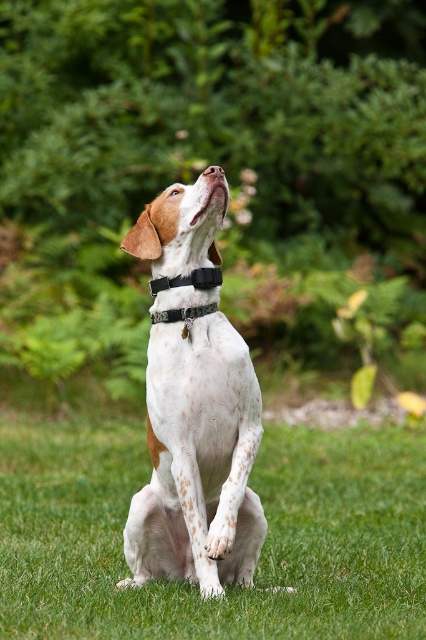
Question: Which point is closer to the camera?

Choices:
 (A) green grass at center
 (B) black fabric neckband at center

Answer: (B)

Question: Is green grass at center to the left of white speckled fur at center from the viewer's perspective?

Choices:
 (A) no
 (B) yes

Answer: (B)

Question: Which object is closer to the camera taking this photo?

Choices:
 (A) black fabric neckband at center
 (B) green grass at center

Answer: (A)

Question: Is white speckled fur at center bigger than black fabric neckband at center?

Choices:
 (A) no
 (B) yes

Answer: (B)

Question: Estimate the real-world distances between objects in this image. Which object is closer to the green grass at center?

Choices:
 (A) black fabric neckband at center
 (B) white speckled fur at center

Answer: (B)

Question: Can you confirm if white speckled fur at center is positioned to the right of black fabric neckband at center?

Choices:
 (A) no
 (B) yes

Answer: (A)